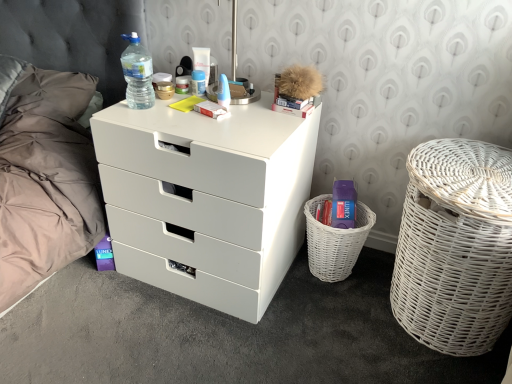
The image size is (512, 384). I want to click on vacant area that lies between white matte chest of drawers at center and white wicker basket at lower right, so point(301,299).